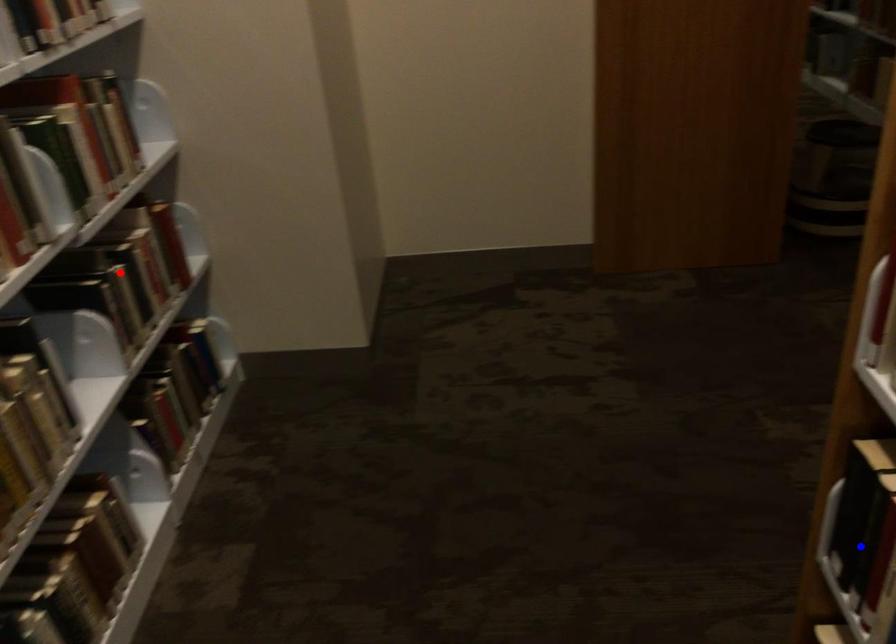
Question: Two points are marked on the image. Which point is closer to the camera?

Choices:
 (A) Blue point is closer.
 (B) Red point is closer.

Answer: (A)